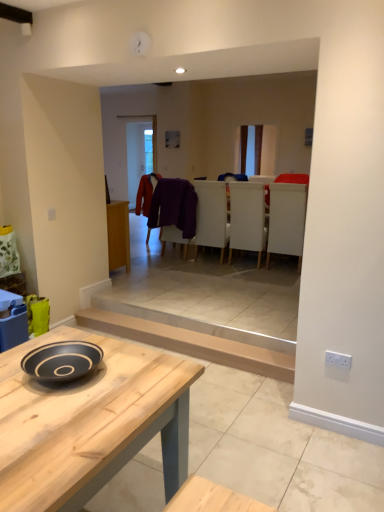
Question: From their relative heights in the image, would you say velvet red coat at center, which is the 2th laundry from front to back, is taller or shorter than white fabric armchair at center, which is counted as the 2th armchair, starting from the left?

Choices:
 (A) tall
 (B) short

Answer: (B)

Question: Is point [137, 202] closer or farther from the camera than point [279, 246]?

Choices:
 (A) closer
 (B) farther

Answer: (A)

Question: Based on their relative distances, which object is nearer to the white matte chair at center?

Choices:
 (A) velvet red coat at center, the first laundry positioned from the back
 (B) white fabric armchair at center, which is counted as the 2th armchair, starting from the left
 (C) white leather armchair at center, positioned as the first armchair in left-to-right order
 (D) natural wood table at center
 (E) light brown wooden plank at lower center

Answer: (C)

Question: Which object is the farthest from the white matte chair at center?

Choices:
 (A) purple fabric at center, which appears as the 1th laundry when viewed from the front
 (B) white fabric armchair at center, which is counted as the 2th armchair, starting from the left
 (C) white leather armchair at center, marked as the 2th armchair in a right-to-left arrangement
 (D) light brown wooden plank at lower center
 (E) natural wood table at center

Answer: (E)